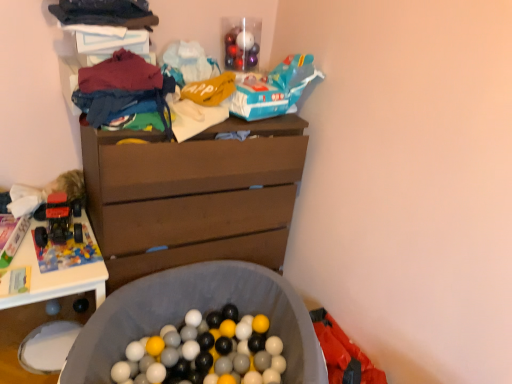
At what (x,y) coordinates should I click in order to perform the action: click on matte blue jeans at upper left, which is the 2th clothing from top to bottom. Please return your answer as a coordinate pair (x, y). Looking at the image, I should click on (121, 88).

From the picture: What is the approximate height of dark blue fabric at upper left, acting as the 1th clothing starting from the top?

The height of dark blue fabric at upper left, acting as the 1th clothing starting from the top, is 2.22 inches.

Image resolution: width=512 pixels, height=384 pixels. Describe the element at coordinates (192, 196) in the screenshot. I see `brown wood chest of drawers at center` at that location.

At what (x,y) coordinates should I click in order to perform the action: click on gray fabric laundry basket at lower center. Please return your answer as a coordinate pair (x, y). The width and height of the screenshot is (512, 384). Looking at the image, I should click on (200, 310).

Find the location of a particular element. Image resolution: width=512 pixels, height=384 pixels. matte blue jeans at upper left, which is the 2th clothing from top to bottom is located at coordinates (121, 88).

Which is closer to the camera, (103,93) or (252,190)?

Point (103,93)

Would you say brown wood chest of drawers at center is part of matte blue jeans at upper left, positioned as the 1th clothing in bottom-to-top order,'s contents?

No, brown wood chest of drawers at center is not inside matte blue jeans at upper left, positioned as the 1th clothing in bottom-to-top order.

The height and width of the screenshot is (384, 512). I want to click on clothing that is the 1st object above the brown wood chest of drawers at center (from a real-world perspective), so click(x=121, y=88).

Is matte blue jeans at upper left, which is the 2th clothing from top to bottom, thinner than brown wood chest of drawers at center?

Yes.

Locate an element on the screen. clothing that is under the dark blue fabric at upper left, acting as the 1th clothing starting from the top (from a real-world perspective) is located at coordinates (121, 88).

Based on the photo, from a real-world perspective, relative to dark blue fabric at upper left, acting as the 1th clothing starting from the top, is matte blue jeans at upper left, positioned as the 1th clothing in bottom-to-top order, vertically above or below?

matte blue jeans at upper left, positioned as the 1th clothing in bottom-to-top order, is situated lower than dark blue fabric at upper left, acting as the 1th clothing starting from the top, in the real world.

Between matte blue jeans at upper left, which is the 2th clothing from top to bottom, and dark blue fabric at upper left, positioned as the 2th clothing in bottom-to-top order, which one has smaller size?

dark blue fabric at upper left, positioned as the 2th clothing in bottom-to-top order, is smaller.

Is matte blue jeans at upper left, positioned as the 1th clothing in bottom-to-top order, shorter than dark blue fabric at upper left, acting as the 1th clothing starting from the top?

Incorrect, the height of matte blue jeans at upper left, positioned as the 1th clothing in bottom-to-top order, does not fall short of that of dark blue fabric at upper left, acting as the 1th clothing starting from the top.

From a real-world perspective, who is located higher, matte blue jeans at upper left, which is the 2th clothing from top to bottom, or gray fabric laundry basket at lower center?

matte blue jeans at upper left, which is the 2th clothing from top to bottom, from a real-world perspective.

Is point (94, 123) more distant than point (103, 323)?

That is False.

From the image's perspective, would you say matte blue jeans at upper left, positioned as the 1th clothing in bottom-to-top order, is positioned over gray fabric laundry basket at lower center?

Yes, from the image's perspective, matte blue jeans at upper left, positioned as the 1th clothing in bottom-to-top order, is above gray fabric laundry basket at lower center.

Which object is positioned more to the left, matte blue jeans at upper left, which is the 2th clothing from top to bottom, or gray fabric laundry basket at lower center?

Positioned to the left is matte blue jeans at upper left, which is the 2th clothing from top to bottom.

Is gray fabric laundry basket at lower center shorter than white plastic table at left?

Yes.

Does gray fabric laundry basket at lower center contain white plastic table at left?

A: Definitely not — white plastic table at left is not inside gray fabric laundry basket at lower center.

From the picture: Which of these two, gray fabric laundry basket at lower center or white plastic table at left, is bigger?

With larger size is gray fabric laundry basket at lower center.

How many degrees apart are the facing directions of gray fabric laundry basket at lower center and white plastic table at left?

The facing directions of gray fabric laundry basket at lower center and white plastic table at left are 33 degrees apart.

Which is more to the right, matte blue jeans at upper left, which is the 2th clothing from top to bottom, or white plastic table at left?

Positioned to the right is matte blue jeans at upper left, which is the 2th clothing from top to bottom.

How distant is matte blue jeans at upper left, positioned as the 1th clothing in bottom-to-top order, from white plastic table at left?

23.27 inches.

From a real-world perspective, between matte blue jeans at upper left, which is the 2th clothing from top to bottom, and white plastic table at left, who is vertically lower?

From a 3D spatial view, white plastic table at left is below.

Is point (142, 91) closer to camera compared to point (71, 281)?

Yes, it is.

From the image's perspective, is dark blue fabric at upper left, positioned as the 2th clothing in bottom-to-top order, located above or below brown wood chest of drawers at center?

Clearly, from the image's perspective, dark blue fabric at upper left, positioned as the 2th clothing in bottom-to-top order, is above brown wood chest of drawers at center.

Which object is further away from the camera taking this photo, dark blue fabric at upper left, acting as the 1th clothing starting from the top, or brown wood chest of drawers at center?

brown wood chest of drawers at center is further away from the camera.

Can you confirm if dark blue fabric at upper left, positioned as the 2th clothing in bottom-to-top order, is shorter than brown wood chest of drawers at center?

Yes, dark blue fabric at upper left, positioned as the 2th clothing in bottom-to-top order, is shorter than brown wood chest of drawers at center.

From the image's perspective, is white plastic table at left located above matte blue jeans at upper left, positioned as the 1th clothing in bottom-to-top order?

No, from the image's perspective, white plastic table at left is not over matte blue jeans at upper left, positioned as the 1th clothing in bottom-to-top order.

Who is bigger, white plastic table at left or matte blue jeans at upper left, which is the 2th clothing from top to bottom?

white plastic table at left.

How many degrees apart are the facing directions of white plastic table at left and matte blue jeans at upper left, positioned as the 1th clothing in bottom-to-top order?

There is a 0.19-degree angle between the facing directions of white plastic table at left and matte blue jeans at upper left, positioned as the 1th clothing in bottom-to-top order.

At what (x,y) coordinates should I click in order to perform the action: click on table below the matte blue jeans at upper left, which is the 2th clothing from top to bottom (from the image's perspective). Please return your answer as a coordinate pair (x, y). The width and height of the screenshot is (512, 384). Looking at the image, I should click on (54, 277).

From the image's perspective, starting from the brown wood chest of drawers at center, which clothing is the 1st one above? Please provide its 2D coordinates.

[(121, 88)]

Locate an element on the screen. The image size is (512, 384). clothing in front of the dark blue fabric at upper left, positioned as the 2th clothing in bottom-to-top order is located at coordinates (121, 88).

From the image, which object appears to be nearer to brown wood chest of drawers at center, white plastic table at left or gray fabric laundry basket at lower center?

gray fabric laundry basket at lower center lies closer to brown wood chest of drawers at center than the other object.

Looking at the image, which one is located further to dark blue fabric at upper left, positioned as the 2th clothing in bottom-to-top order, brown wood chest of drawers at center or white plastic table at left?

white plastic table at left is positioned further to the anchor dark blue fabric at upper left, positioned as the 2th clothing in bottom-to-top order.

Estimate the real-world distances between objects in this image. Which object is further from brown wood chest of drawers at center, matte blue jeans at upper left, which is the 2th clothing from top to bottom, or white plastic table at left?

white plastic table at left is further to brown wood chest of drawers at center.

Considering their positions, is dark blue fabric at upper left, acting as the 1th clothing starting from the top, positioned closer to white plastic table at left than matte blue jeans at upper left, positioned as the 1th clothing in bottom-to-top order?

Among the two, matte blue jeans at upper left, positioned as the 1th clothing in bottom-to-top order, is located nearer to white plastic table at left.

Which object lies nearer to the anchor point white plastic table at left, brown wood chest of drawers at center or dark blue fabric at upper left, acting as the 1th clothing starting from the top?

brown wood chest of drawers at center is positioned closer to the anchor white plastic table at left.

Considering their positions, is dark blue fabric at upper left, positioned as the 2th clothing in bottom-to-top order, positioned further to gray fabric laundry basket at lower center than white plastic table at left?

Based on the image, dark blue fabric at upper left, positioned as the 2th clothing in bottom-to-top order, appears to be further to gray fabric laundry basket at lower center.

Based on their spatial positions, is matte blue jeans at upper left, which is the 2th clothing from top to bottom, or gray fabric laundry basket at lower center further from dark blue fabric at upper left, positioned as the 2th clothing in bottom-to-top order?

The object further to dark blue fabric at upper left, positioned as the 2th clothing in bottom-to-top order, is gray fabric laundry basket at lower center.

Looking at the image, which one is located further to brown wood chest of drawers at center, gray fabric laundry basket at lower center or dark blue fabric at upper left, positioned as the 2th clothing in bottom-to-top order?

dark blue fabric at upper left, positioned as the 2th clothing in bottom-to-top order, is positioned further to the anchor brown wood chest of drawers at center.

Locate an element on the screen. The height and width of the screenshot is (384, 512). clothing between dark blue fabric at upper left, positioned as the 2th clothing in bottom-to-top order, and white plastic table at left from top to bottom is located at coordinates (121, 88).

Locate an element on the screen. The image size is (512, 384). chest of drawers between white plastic table at left and gray fabric laundry basket at lower center is located at coordinates (192, 196).

Where is `chest of drawers between dark blue fabric at upper left, acting as the 1th clothing starting from the top, and white plastic table at left in the up-down direction`? chest of drawers between dark blue fabric at upper left, acting as the 1th clothing starting from the top, and white plastic table at left in the up-down direction is located at coordinates (192, 196).

Where is `table between dark blue fabric at upper left, acting as the 1th clothing starting from the top, and gray fabric laundry basket at lower center from top to bottom`? The height and width of the screenshot is (384, 512). table between dark blue fabric at upper left, acting as the 1th clothing starting from the top, and gray fabric laundry basket at lower center from top to bottom is located at coordinates (54, 277).